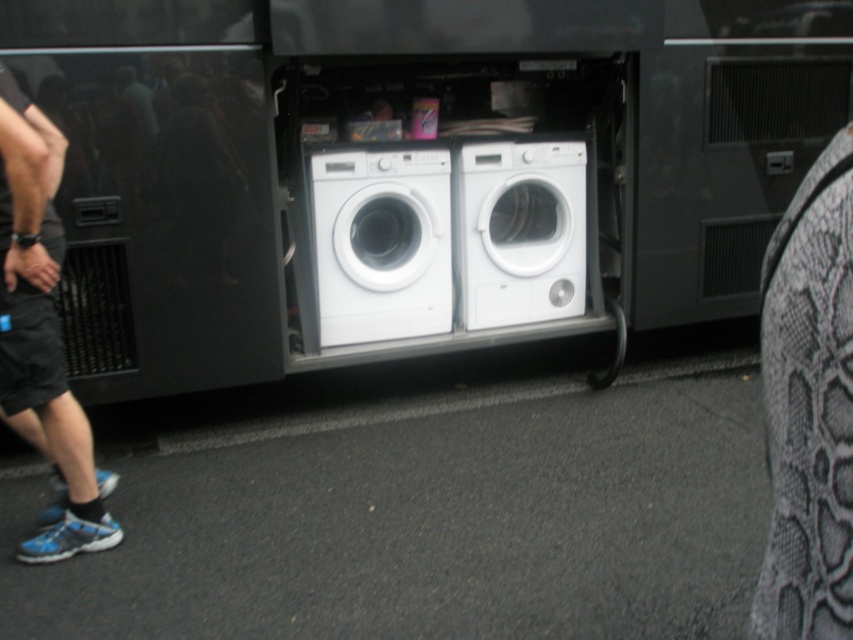
Question: Can you confirm if blue fabric shorts at lower left is positioned above white plastic washing machine at center?

Choices:
 (A) yes
 (B) no

Answer: (B)

Question: Which of the following is the farthest from the observer?

Choices:
 (A) white glossy washing machine at center
 (B) white plastic washing machine at center

Answer: (B)

Question: Which object is positioned farthest from the white plastic washing machine at center?

Choices:
 (A) blue fabric shorts at lower left
 (B) white glossy washing machine at center

Answer: (A)

Question: Which of the following is the farthest from the observer?

Choices:
 (A) (508, 256)
 (B) (61, 445)
 (C) (372, 266)

Answer: (A)

Question: Can you confirm if white glossy washing machine at center is smaller than white plastic washing machine at center?

Choices:
 (A) yes
 (B) no

Answer: (B)

Question: Can you confirm if white glossy washing machine at center is bigger than white plastic washing machine at center?

Choices:
 (A) no
 (B) yes

Answer: (B)